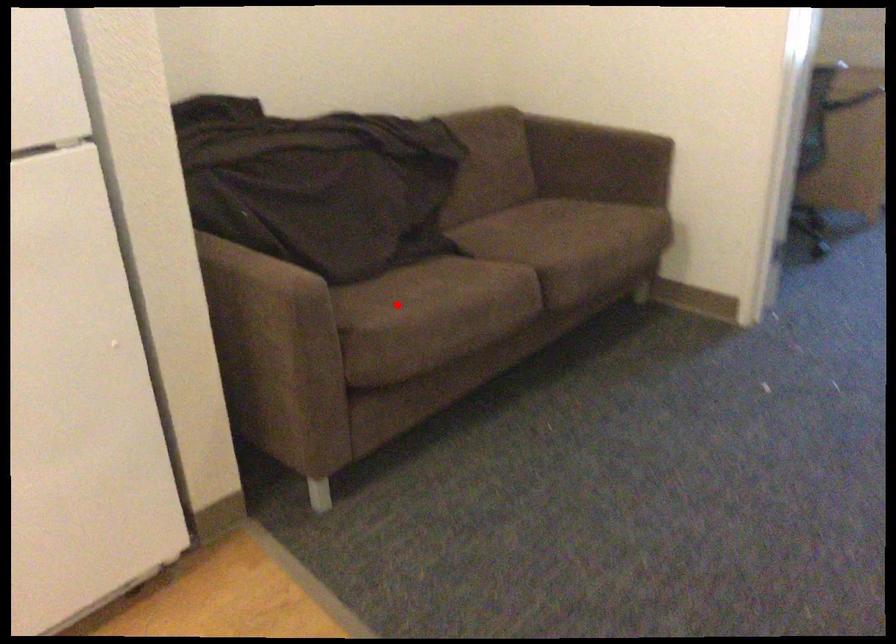
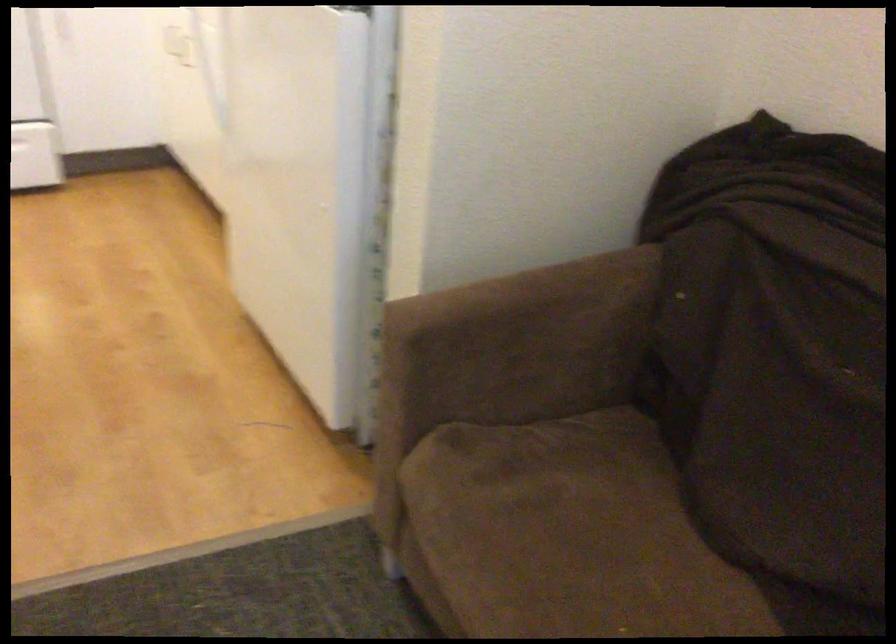
Question: I am providing you with two images of the same scene from different viewpoints. In image1, a red point is highlighted. Considering the same 3D point in image2, which of the following is correct?

Choices:
 (A) It is closer
 (B) It is farther

Answer: (A)